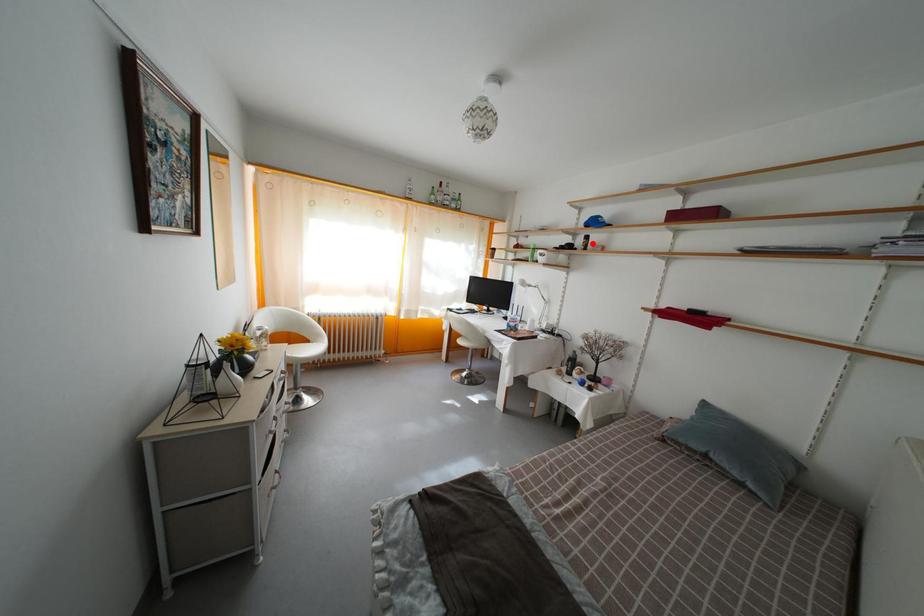
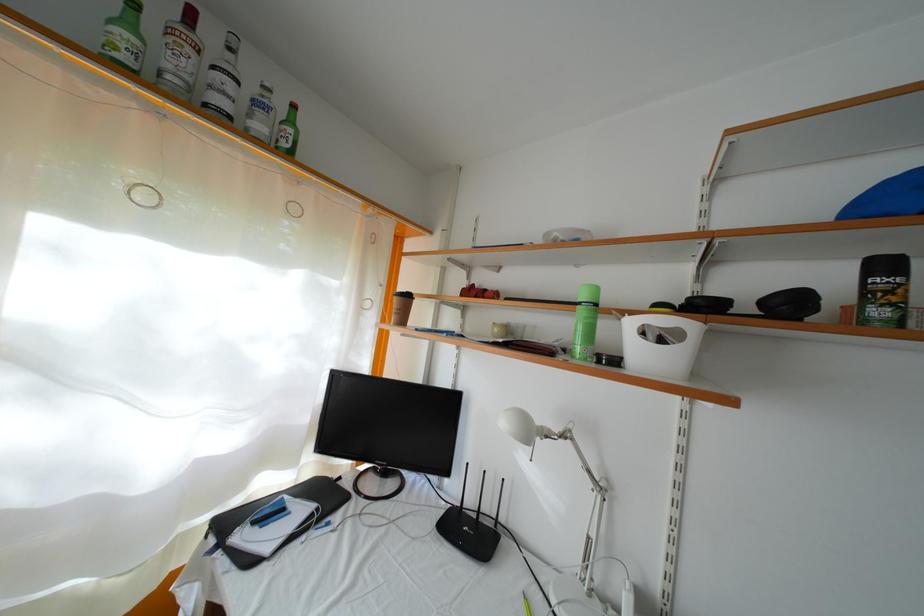
Locate, in the second image, the point that corresponds to the highlighted location in the first image.

(891, 273)